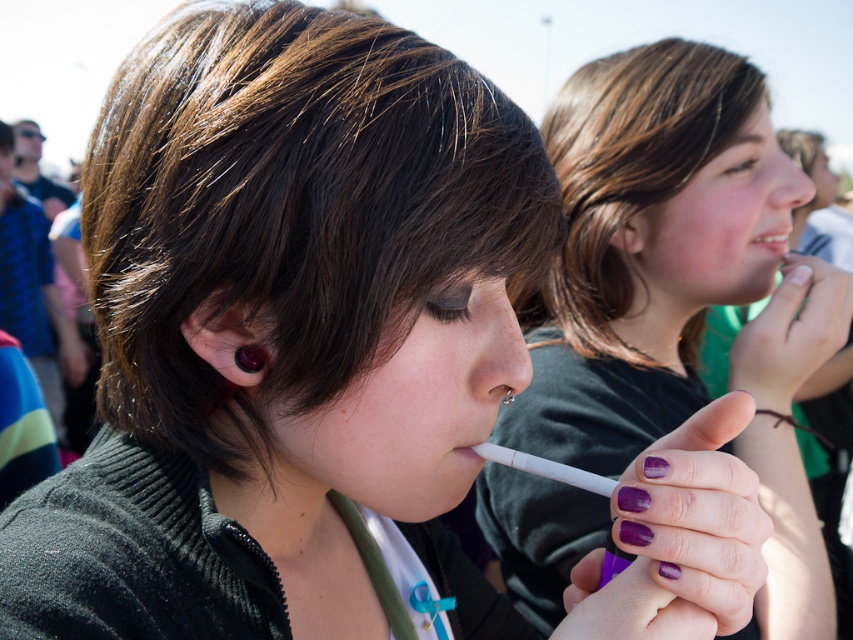
Question: Which object appears closest to the camera in this image?

Choices:
 (A) purple nail polish at center
 (B) white glossy teeth at upper center

Answer: (A)

Question: Is white glossy teeth at upper center bigger than purple matte lipstick at lower center?

Choices:
 (A) yes
 (B) no

Answer: (A)

Question: Among these points, which one is farthest from the camera?

Choices:
 (A) (775, 252)
 (B) (467, 445)

Answer: (A)

Question: Can you confirm if purple nail polish at center is wider than purple matte lipstick at lower center?

Choices:
 (A) no
 (B) yes

Answer: (B)

Question: Is purple nail polish at center positioned before white glossy teeth at upper center?

Choices:
 (A) yes
 (B) no

Answer: (A)

Question: Which point appears farthest from the camera in this image?

Choices:
 (A) (492, 451)
 (B) (599, 515)

Answer: (B)